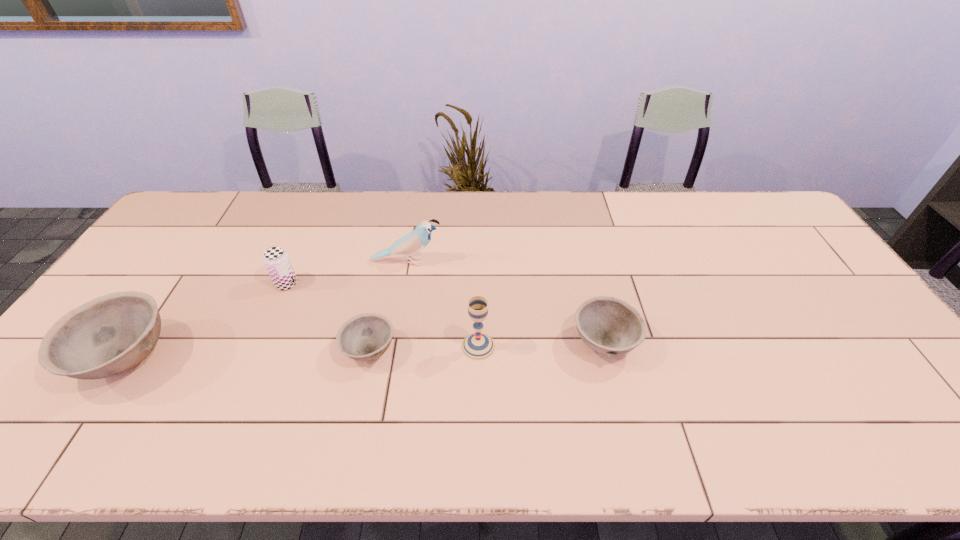
The image size is (960, 540). What are the coordinates of `vacant space at the left edge of the desktop` in the screenshot? It's located at (141, 265).

The image size is (960, 540). In order to click on free space at the far left corner of the desktop in this screenshot , I will do `click(225, 210)`.

Find the location of a particular element. free space at the far right corner of the desktop is located at coordinates (743, 212).

Find the location of `free space between the farthest object and the fifth object from left to right`. free space between the farthest object and the fifth object from left to right is located at coordinates (443, 304).

Locate an element on the screen. This screenshot has height=540, width=960. unoccupied position between the fifth tallest object and the chalice is located at coordinates (541, 344).

Identify the location of vacant space that is in between the fifth object from left to right and the bird. (443, 304).

I want to click on vacant point located between the fifth object from left to right and the leftmost object, so click(302, 352).

Identify the location of vacant space that is in between the leftmost object and the bird. Image resolution: width=960 pixels, height=540 pixels. (267, 310).

At what (x,y) coordinates should I click in order to perform the action: click on vacant space that's between the second object from left to right and the fifth tallest object. Please return your answer as a coordinate pair (x, y). Looking at the image, I should click on (445, 313).

You are a GUI agent. You are given a task and a screenshot of the screen. Output one action in this format:
    pyautogui.click(x=<x>, y=<y>)
    Task: Click on the vacant area that lies between the shortest object and the farthest object
    The image size is (960, 540).
    Given the screenshot: What is the action you would take?
    pyautogui.click(x=388, y=306)